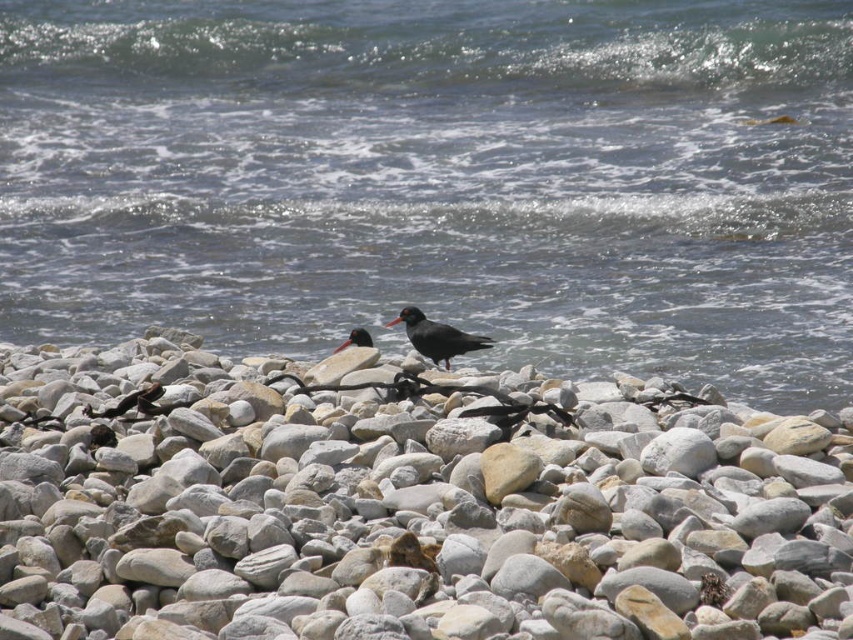
You are standing on the rocky shoreline and want to throw a stone to hit the smooth black bird at center. The clear water at center is in between you and the bird. Can you reach the bird without hitting the water first?

The clear water at center is 10.14 meters away from the smooth black bird at center. Since the water is between you and the bird, you would have to throw the stone past the water to reach the bird, but the distance is quite far. However, the question is about whether you can reach the bird without hitting the water first. Since the water is in between, any throw towards the bird would pass through the water area first, meaning the stone would hit the water before reaching the bird. Therefore, it is not poss

You are standing at the edge of the rocky shoreline and want to place a small flag at the point that is closer to you. Which point should you choose between point (689, 52) and point (149, 404)?

Point (149, 404) is closer to you than point (689, 52), so you should choose point (149, 404) to place the flag.